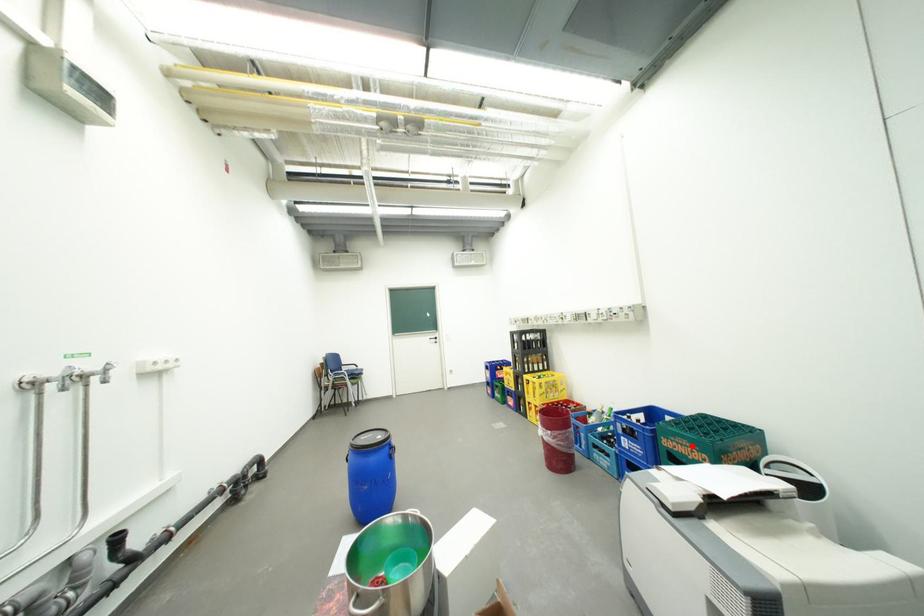
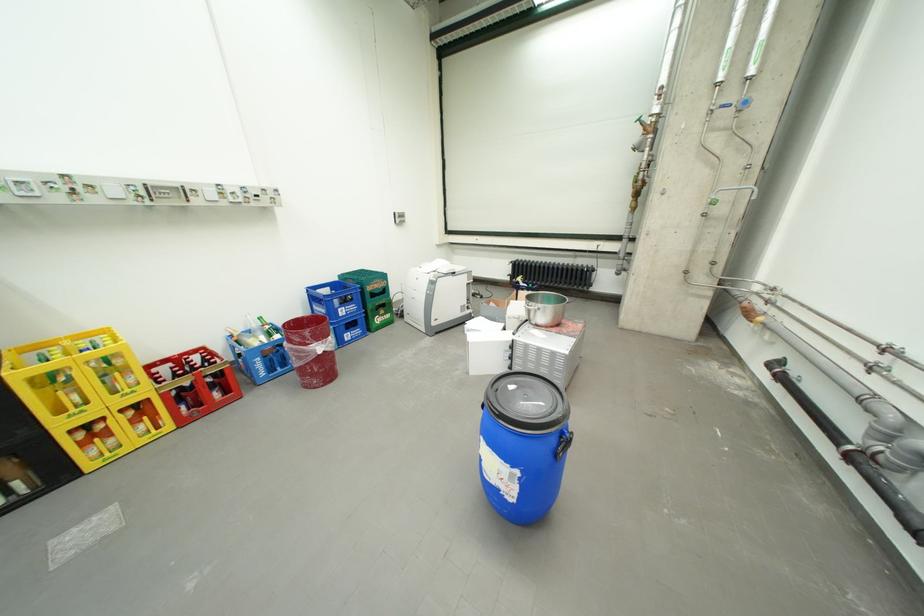
Where in the second image is the point corresponding to the highlighted location from the first image?

(386, 285)